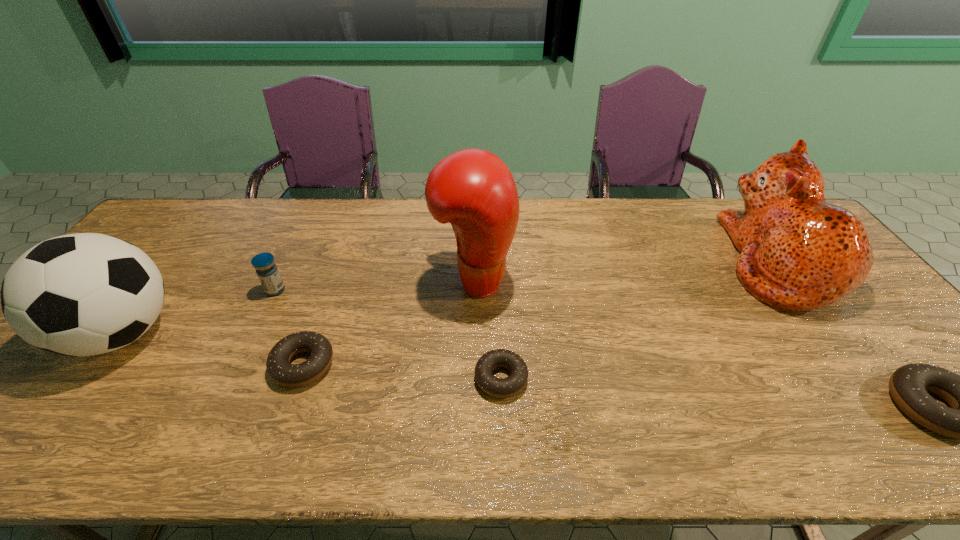
Find the location of a particular element. This screenshot has width=960, height=540. object that is at the right edge is located at coordinates (798, 253).

Find the location of a particular element. object positioned at the near left corner is located at coordinates (83, 294).

Find the location of a particular element. object that is at the far right corner is located at coordinates (798, 253).

Identify the location of vacant space at the far edge of the desktop. The height and width of the screenshot is (540, 960). (243, 214).

Image resolution: width=960 pixels, height=540 pixels. In order to click on vacant space at the near edge in this screenshot , I will do `click(576, 400)`.

The width and height of the screenshot is (960, 540). In order to click on vacant space at the right edge in this screenshot , I will do `click(865, 300)`.

This screenshot has height=540, width=960. Find the location of `vacant region between the second doughnut from left to right and the cat`. vacant region between the second doughnut from left to right and the cat is located at coordinates (639, 320).

I want to click on vacant area that lies between the cat and the fourth tallest object, so [527, 276].

Locate an element on the screen. The image size is (960, 540). empty space between the boxing glove and the shortest doughnut is located at coordinates (488, 329).

Find the location of `free space between the boxing glove and the fourth shortest object`. free space between the boxing glove and the fourth shortest object is located at coordinates coord(374,285).